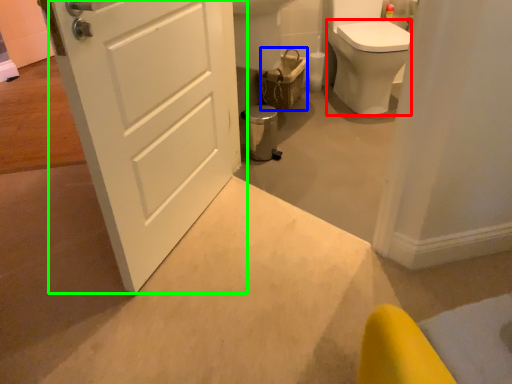
Question: Which is farther away from bidet (highlighted by a red box)? basket (highlighted by a blue box) or door (highlighted by a green box)?

Choices:
 (A) basket
 (B) door

Answer: (B)